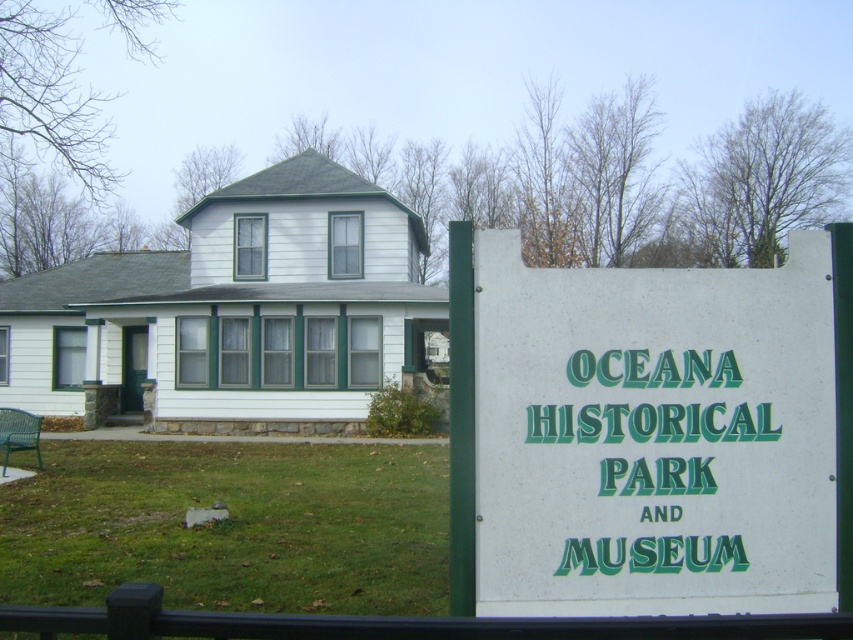
In the scene shown: You are a visitor at OCEANA HISTORICAL PARK AND MUSEUM and want to take a photo of the white plastic sign at center while standing on the green grass at lower center. Can you do this without moving from your current position?

The green grass at lower center is behind the white plastic sign at center, so you can take a photo of the white plastic sign at center while standing on the green grass at lower center without moving.

You are standing in front of the house at OCEANA HISTORICAL PARK AND MUSEUM. You notice two points marked on the image. The first point is at coordinates point (x=795, y=465) and the second point is at point (x=96, y=586). Which of these points is closer to you?

Point (x=795, y=465) is closer to the camera than point (x=96, y=586).